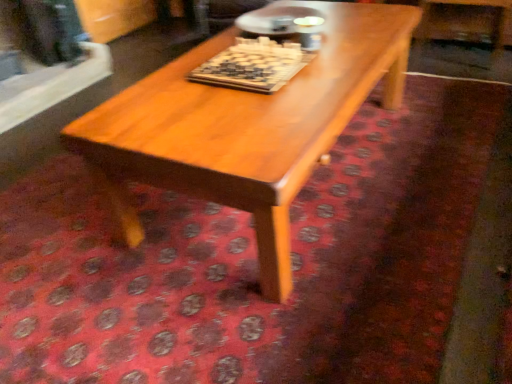
Question: Does point (272, 91) appear closer or farther from the camera than point (317, 105)?

Choices:
 (A) closer
 (B) farther

Answer: (B)

Question: From a real-world perspective, is wooden chessboard at center positioned above or below light brown wood coffee table at center?

Choices:
 (A) above
 (B) below

Answer: (A)

Question: Based on their positions, is wooden chessboard at center located to the left or right of light brown wood coffee table at center?

Choices:
 (A) left
 (B) right

Answer: (A)

Question: In terms of size, does light brown wood coffee table at center appear bigger or smaller than wooden chessboard at center?

Choices:
 (A) small
 (B) big

Answer: (B)

Question: Is light brown wood coffee table at center wider or thinner than wooden chessboard at center?

Choices:
 (A) thin
 (B) wide

Answer: (B)

Question: Considering their positions, is light brown wood coffee table at center located in front of or behind wooden chessboard at center?

Choices:
 (A) behind
 (B) front

Answer: (B)

Question: From the image's perspective, is light brown wood coffee table at center positioned above or below wooden chessboard at center?

Choices:
 (A) above
 (B) below

Answer: (B)